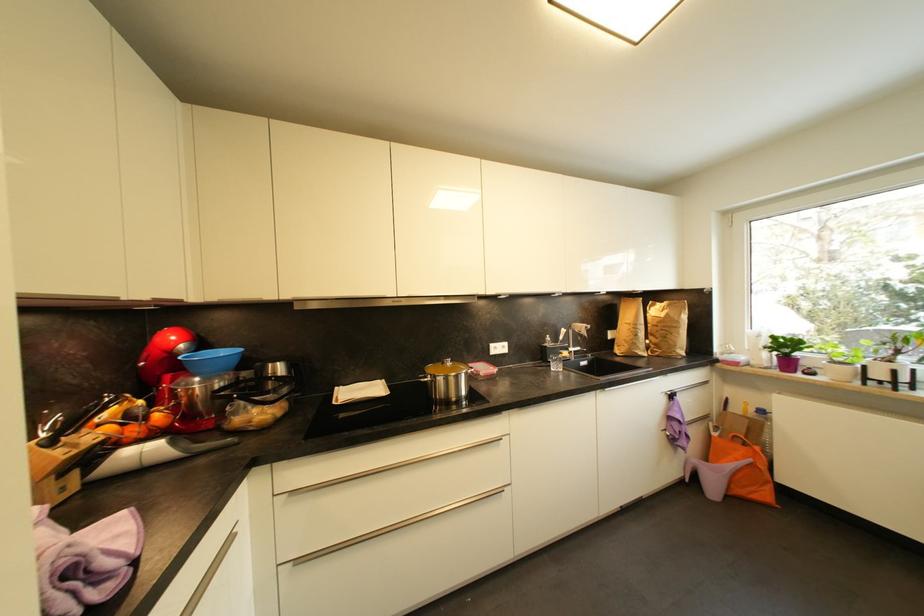
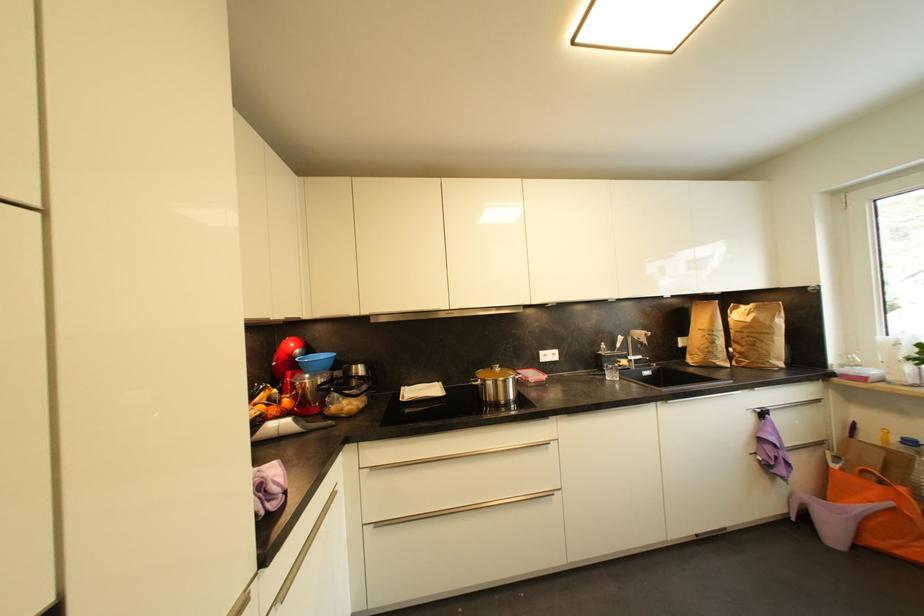
Locate, in the second image, the point that corresponds to pixel 663 323 in the first image.

(748, 330)